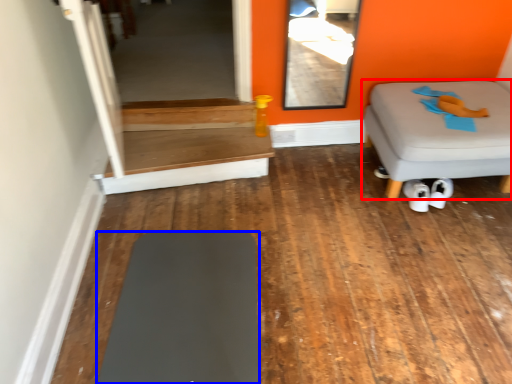
Question: Which object appears closest to the camera in this image, furniture (highlighted by a red box) or furniture (highlighted by a blue box)?

Choices:
 (A) furniture
 (B) furniture

Answer: (B)